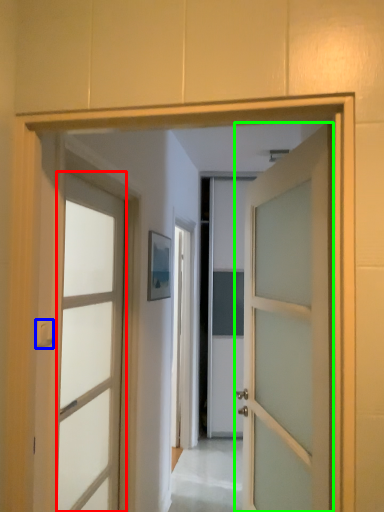
Question: Estimate the real-world distances between objects in this image. Which object is farther from door (highlighted by a red box), door handle (highlighted by a blue box) or door (highlighted by a green box)?

Choices:
 (A) door handle
 (B) door

Answer: (B)